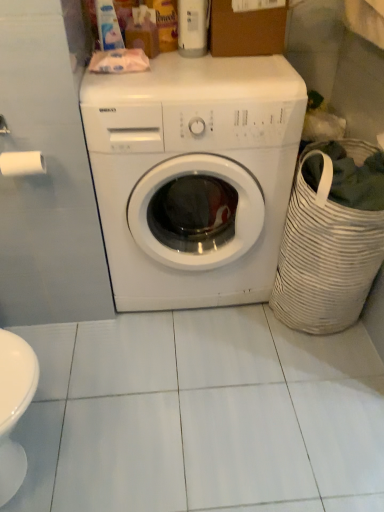
The height and width of the screenshot is (512, 384). I want to click on brown cardboard box at upper center, so click(246, 31).

At what (x,y) coordinates should I click in order to perform the action: click on white glossy washing machine at center. Please return your answer as a coordinate pair (x, y). The width and height of the screenshot is (384, 512). Looking at the image, I should click on (193, 176).

Is white glossy washing machine at center surrounded by brown cardboard box at upper center?

No, brown cardboard box at upper center does not contain white glossy washing machine at center.

Does brown cardboard box at upper center have a smaller size compared to white glossy washing machine at center?

Yes, brown cardboard box at upper center is smaller than white glossy washing machine at center.

Does brown cardboard box at upper center come in front of white glossy washing machine at center?

That is False.

Is brown cardboard box at upper center looking in the opposite direction of white glossy washing machine at center?

brown cardboard box at upper center does not have its back to white glossy washing machine at center.

From a real-world perspective, is white glossy washing machine at center physically above brown cardboard box at upper center?

No, from a real-world perspective, white glossy washing machine at center is not above brown cardboard box at upper center.

How different are the orientations of white glossy washing machine at center and brown cardboard box at upper center in degrees?

There is a 1.32-degree angle between the facing directions of white glossy washing machine at center and brown cardboard box at upper center.

Does white glossy washing machine at center turn towards brown cardboard box at upper center?

No, white glossy washing machine at center does not turn towards brown cardboard box at upper center.

From the image's perspective, which is below, white woven laundry basket at right or white glossy washing machine at center?

From the image's view, white woven laundry basket at right is below.

Is the depth of white woven laundry basket at right greater than that of white glossy washing machine at center?

Yes, it is behind white glossy washing machine at center.

Is white woven laundry basket at right facing towards white glossy washing machine at center?

No.

Which point is more forward, (148, 191) or (294, 307)?

The point (148, 191) is more forward.

Considering the relative positions of white glossy washing machine at center and white woven laundry basket at right in the image provided, is white glossy washing machine at center in front of white woven laundry basket at right?

Yes, it is.

Is white glossy washing machine at center wider or thinner than white woven laundry basket at right?

Considering their sizes, white glossy washing machine at center looks broader than white woven laundry basket at right.

From a real-world perspective, which object rests below the other?

white woven laundry basket at right is physically lower.

Could you tell me if brown cardboard box at upper center is turned towards white matte toilet paper at left?

No.

From a real-world perspective, which is physically below, brown cardboard box at upper center or white matte toilet paper at left?

white matte toilet paper at left.

Considering the points (31, 153) and (264, 24), which point is in front, point (31, 153) or point (264, 24)?

The point (31, 153) is more forward.

Considering the relative positions of white matte toilet paper at left and brown cardboard box at upper center in the image provided, is white matte toilet paper at left behind brown cardboard box at upper center?

No.

Looking at this image, from a real-world perspective, is brown cardboard box at upper center positioned over white woven laundry basket at right based on gravity?

Yes, from a real-world perspective, brown cardboard box at upper center is above white woven laundry basket at right.

Does brown cardboard box at upper center appear on the right side of white woven laundry basket at right?

Incorrect, brown cardboard box at upper center is not on the right side of white woven laundry basket at right.

Between brown cardboard box at upper center and white woven laundry basket at right, which one has smaller size?

Smaller between the two is brown cardboard box at upper center.

This screenshot has height=512, width=384. In order to click on cardboard box behind the white glossy washing machine at center in this screenshot , I will do `click(246, 31)`.

There is a white glossy washing machine at center. Where is `cardboard box above it (from a real-world perspective)`? Image resolution: width=384 pixels, height=512 pixels. cardboard box above it (from a real-world perspective) is located at coordinates (246, 31).

From the image, which object appears to be nearer to white matte toilet paper at left, white glossy washing machine at center or white woven laundry basket at right?

Among the two, white glossy washing machine at center is located nearer to white matte toilet paper at left.

From the image, which object appears to be nearer to brown cardboard box at upper center, white matte toilet paper at left or white glossy washing machine at center?

The object closer to brown cardboard box at upper center is white glossy washing machine at center.

From the picture: Based on their spatial positions, is white woven laundry basket at right or brown cardboard box at upper center closer to white glossy washing machine at center?

white woven laundry basket at right.

From the image, which object appears to be nearer to white matte toilet paper at left, white woven laundry basket at right or white glossy washing machine at center?

The object closer to white matte toilet paper at left is white glossy washing machine at center.

Looking at this image, based on their spatial positions, is white glossy washing machine at center or white matte toilet paper at left further from white woven laundry basket at right?

white matte toilet paper at left is positioned further to the anchor white woven laundry basket at right.

Considering their positions, is brown cardboard box at upper center positioned further to white matte toilet paper at left than white glossy washing machine at center?

Among the two, brown cardboard box at upper center is located further to white matte toilet paper at left.

When comparing their distances from white woven laundry basket at right, does white matte toilet paper at left or white glossy washing machine at center seem closer?

white glossy washing machine at center.

Looking at the image, which one is located closer to white woven laundry basket at right, brown cardboard box at upper center or white glossy washing machine at center?

white glossy washing machine at center.

This screenshot has width=384, height=512. I want to click on cardboard box located between white matte toilet paper at left and white woven laundry basket at right in the left-right direction, so click(x=246, y=31).

Image resolution: width=384 pixels, height=512 pixels. Identify the location of washing machine situated between white matte toilet paper at left and white woven laundry basket at right from left to right. (193, 176).

Locate an element on the screen. The height and width of the screenshot is (512, 384). washing machine located between white matte toilet paper at left and brown cardboard box at upper center in the left-right direction is located at coordinates (193, 176).

This screenshot has height=512, width=384. Identify the location of washing machine that lies between brown cardboard box at upper center and white woven laundry basket at right from top to bottom. (193, 176).